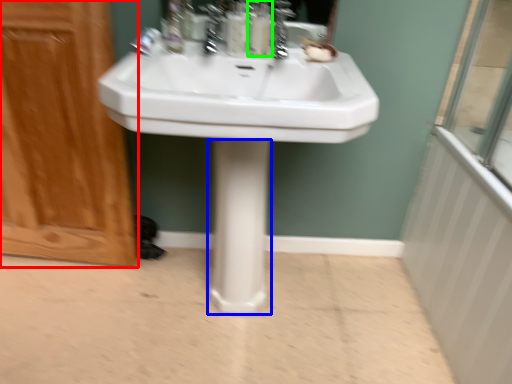
Question: Estimate the real-world distances between objects in this image. Which object is farther from screen door (highlighted by a red box), bidet (highlighted by a blue box) or soap dispenser (highlighted by a green box)?

Choices:
 (A) bidet
 (B) soap dispenser

Answer: (B)